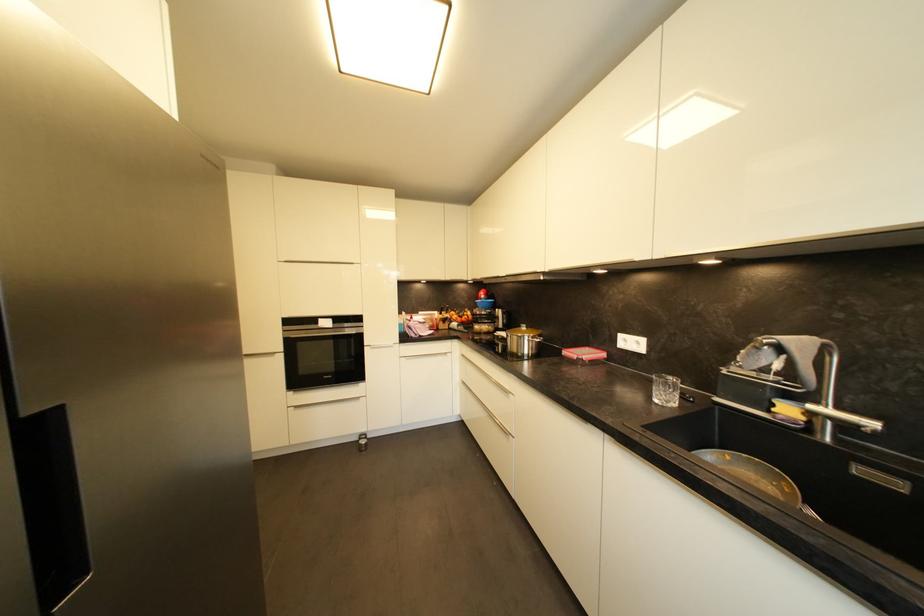
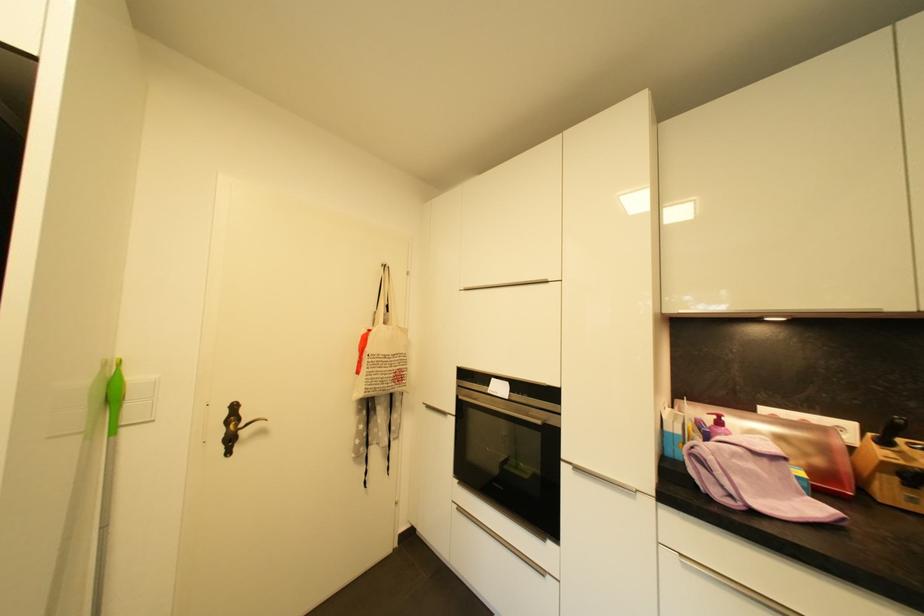
Find the pixel in the second image that matches point (445, 315) in the first image.

(890, 445)